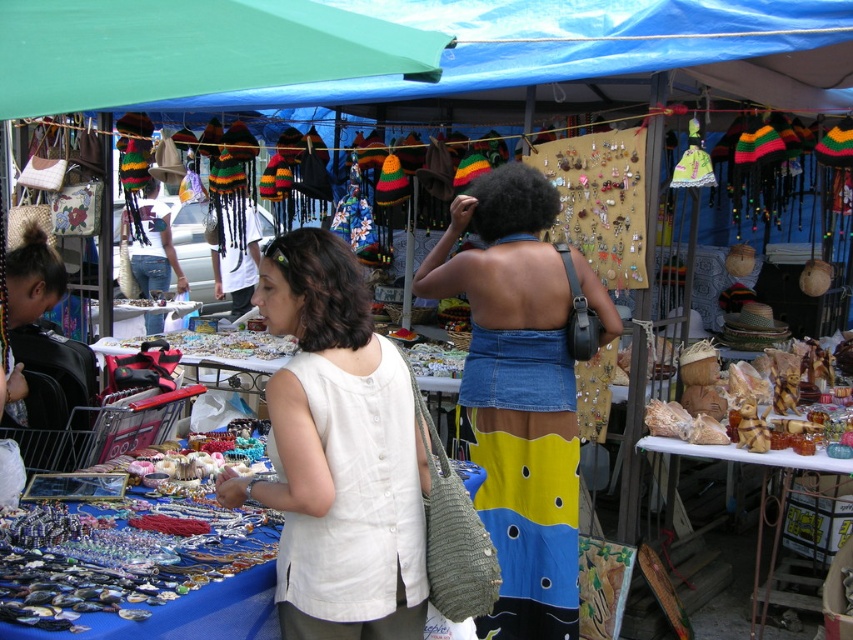
Consider the image. You are standing at the point marked as point (517,394) in the market scene. Which object are you closest to?

The point (517,394) is on the denim skirt at center, so you are closest to the denim skirt at center.

You are a customer at the market and want to pick up the white linen blouse at center and the denim skirt at center. Which item should you reach for first if you want to grab the one closer to you?

The white linen blouse at center is closer to the viewer than the denim skirt at center, so you should reach for the white linen blouse at center first.

Looking at the bustling market scene, where is the white linen blouse at center in relation to the green fabric canopy at upper left?

The white linen blouse at center is located below the green fabric canopy at upper left.